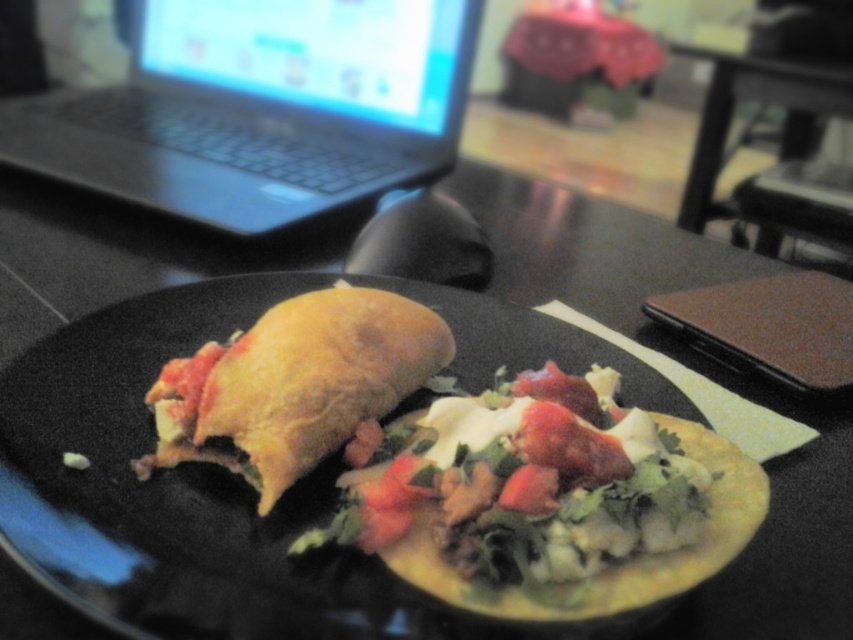
Question: Does black plastic laptop at upper left appear over black plastic table at center?

Choices:
 (A) yes
 (B) no

Answer: (B)

Question: Which point is closer to the camera taking this photo?

Choices:
 (A) (294, 432)
 (B) (465, 422)
 (C) (802, 86)

Answer: (A)

Question: Does golden brown tortilla at center appear on the left side of black plastic table at center?

Choices:
 (A) yes
 (B) no

Answer: (A)

Question: Which of the following is the closest to the observer?

Choices:
 (A) (459, 576)
 (B) (723, 124)

Answer: (A)

Question: Which of the following is the farthest from the observer?

Choices:
 (A) (347, 74)
 (B) (706, 497)
 (C) (239, 381)

Answer: (A)

Question: Is black plastic laptop at upper left to the left of black plastic table at center from the viewer's perspective?

Choices:
 (A) yes
 (B) no

Answer: (A)